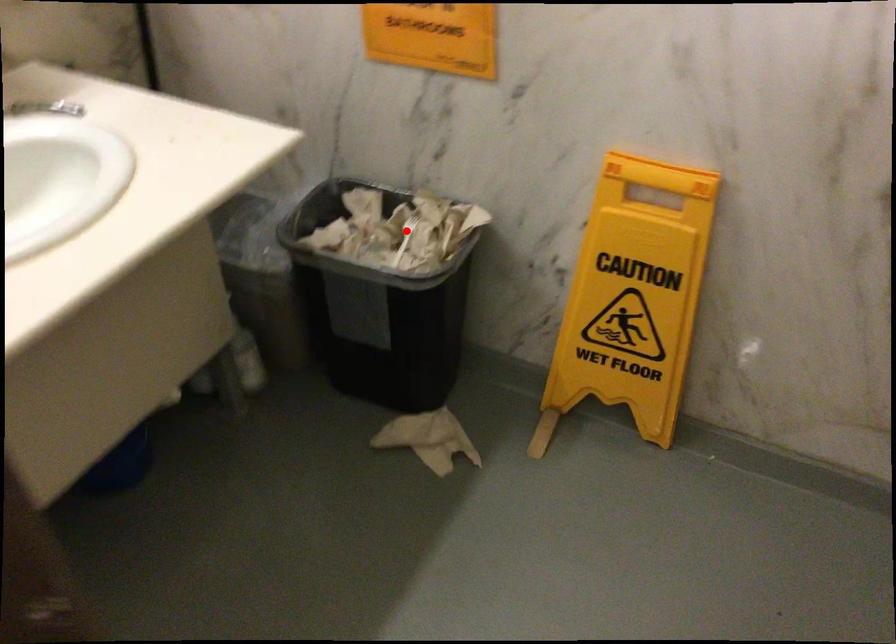
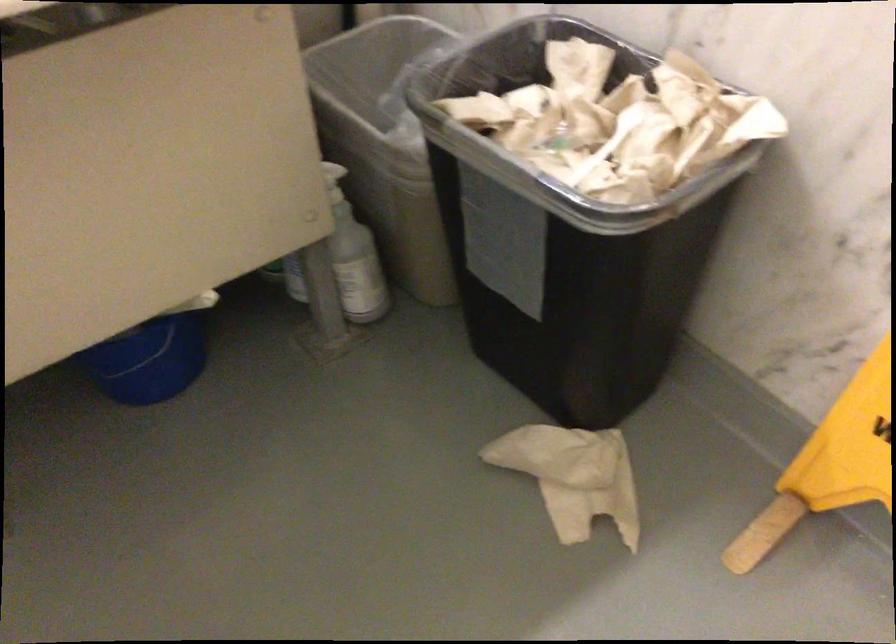
The point at the highlighted location is marked in the first image. Where is the corresponding point in the second image?

(618, 122)